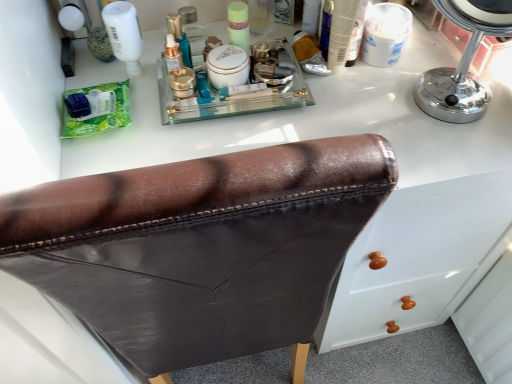
Where is `vacant area situated below chrome/metallic mirror at upper right (from a real-world perspective)`? This screenshot has width=512, height=384. vacant area situated below chrome/metallic mirror at upper right (from a real-world perspective) is located at coordinates (449, 102).